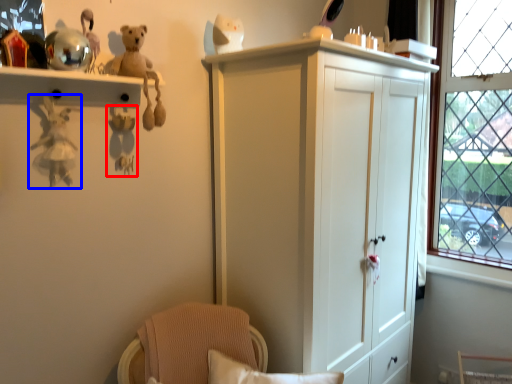
Question: Among these objects, which one is farthest to the camera, toy (highlighted by a red box) or toy (highlighted by a blue box)?

Choices:
 (A) toy
 (B) toy

Answer: (A)